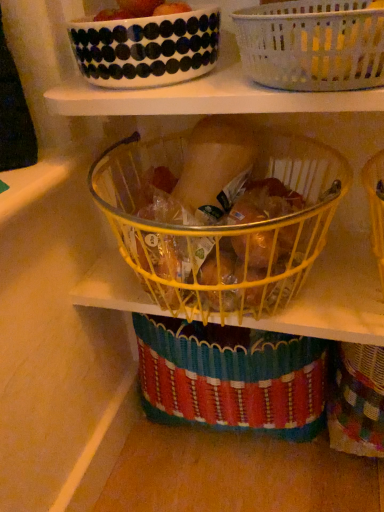
Question: From the image's perspective, relative to smooth red tomato at upper center, is white glossy bowl at upper center above or below?

Choices:
 (A) below
 (B) above

Answer: (A)

Question: Looking at their shapes, would you say white glossy bowl at upper center is wider or thinner than smooth red tomato at upper center?

Choices:
 (A) thin
 (B) wide

Answer: (B)

Question: Which is farther from the white glossy bowl at upper center?

Choices:
 (A) yellow wire basket at center, the first basket positioned from the bottom
 (B) white woven basket at upper center, which is the 2th basket in bottom-to-top order
 (C) smooth red tomato at upper center

Answer: (A)

Question: Which of these objects is positioned closest to the white woven basket at upper center, which is the 2th basket in bottom-to-top order?

Choices:
 (A) smooth red tomato at upper center
 (B) white glossy bowl at upper center
 (C) yellow wire basket at center, which ranks as the second basket in top-to-bottom order

Answer: (B)